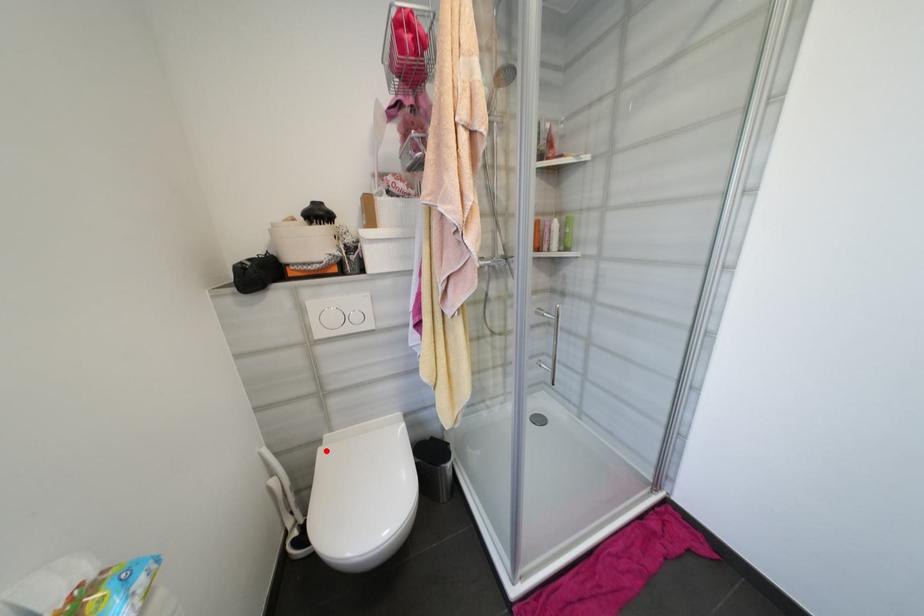
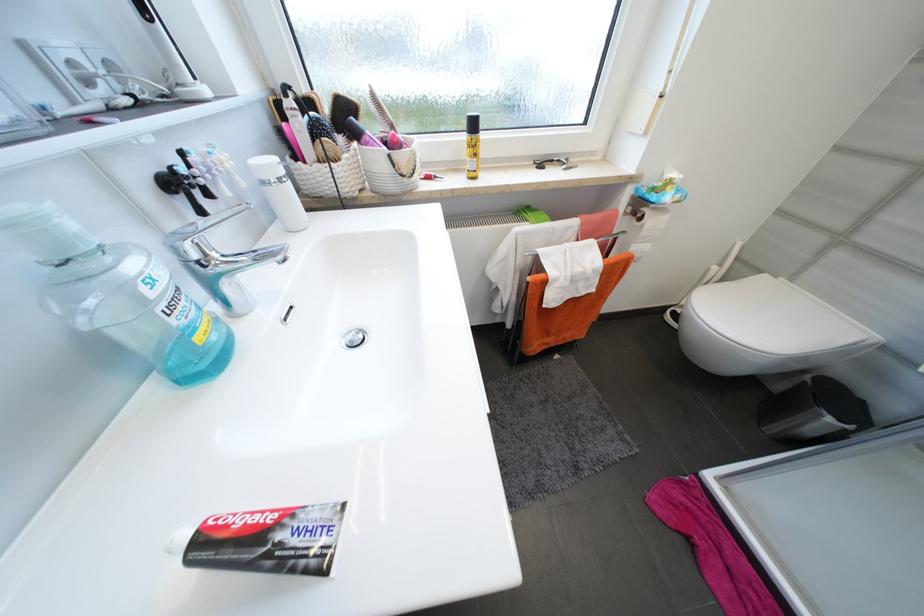
Question: I am providing you with two images of the same scene from different viewpoints. Given a red point in image1, look at the same physical point in image2. Is it:

Choices:
 (A) Closer to the viewpoint
 (B) Farther from the viewpoint

Answer: (B)